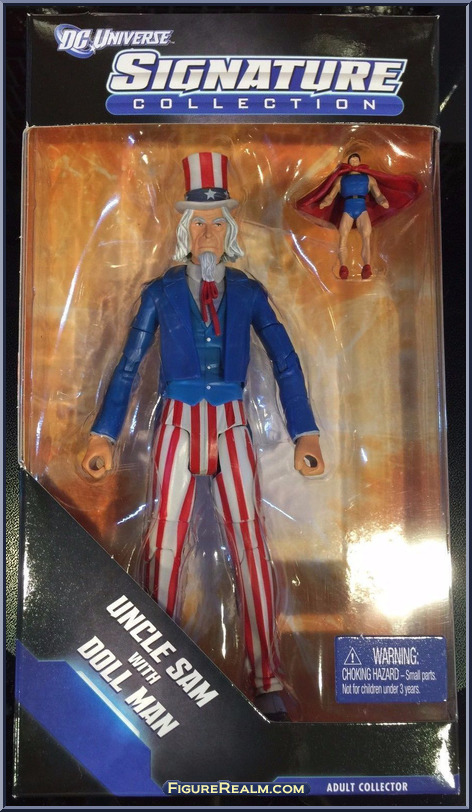
Where is `action figures`? Image resolution: width=472 pixels, height=812 pixels. action figures is located at coordinates (184, 333), (353, 195).